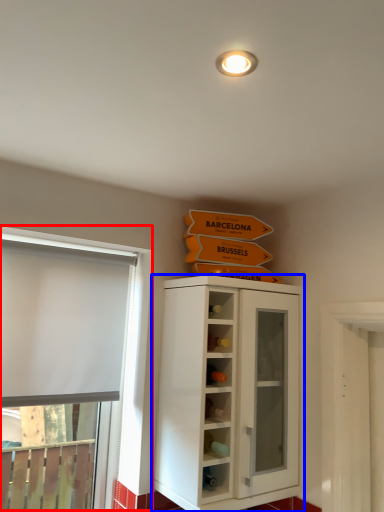
Question: Which of the following is the farthest to the observer, window (highlighted by a red box) or cupboard (highlighted by a blue box)?

Choices:
 (A) window
 (B) cupboard

Answer: (A)